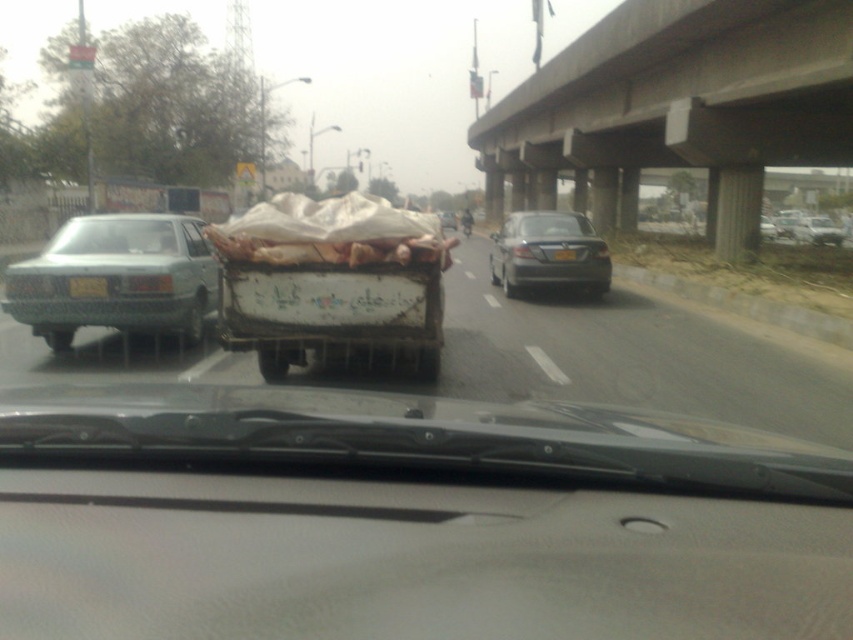
You are a passenger in the shiny black sedan at center and want to read the text on the black plastic license plate at rear. Can you clearly see the text on the license plate from your current position?

The shiny black sedan at center is further to the viewer than the black plastic license plate at rear, so the license plate is behind the sedan. Therefore, you cannot see the text on the black plastic license plate at rear from your current position in the shiny black sedan at center.

You are a delivery driver who needs to load a tall package onto a vehicle. You see the concrete at upper center and the white painted wood cart at center in the image. Which object would be a better choice for placing the package due to its height?

The concrete at upper center is much taller than the white painted wood cart at center, so it would be a better choice for placing the tall package.